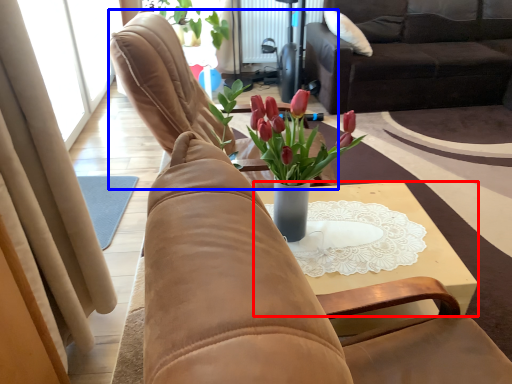
Question: Which object is closer to the camera taking this photo, table (highlighted by a red box) or chair (highlighted by a blue box)?

Choices:
 (A) table
 (B) chair

Answer: (A)